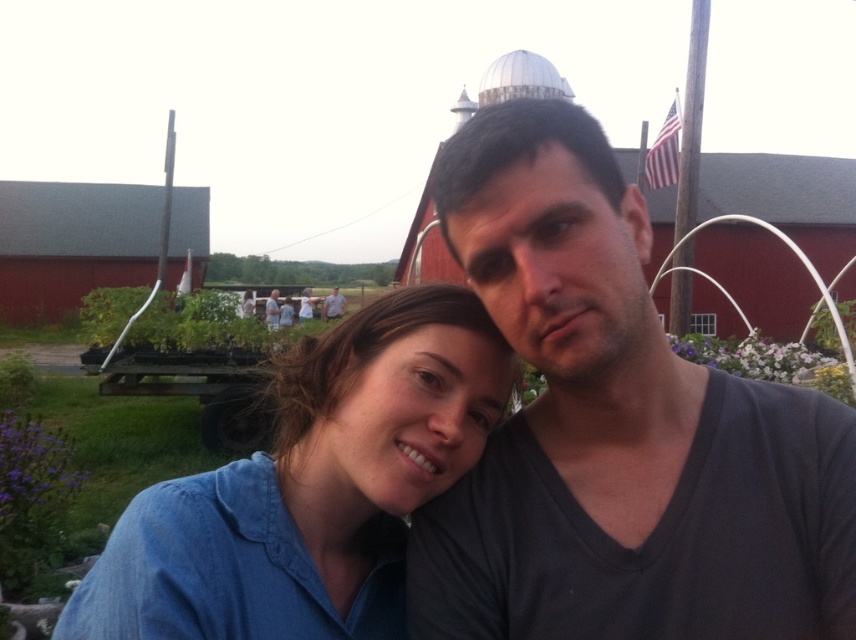
You are a photographer adjusting the camera settings to ensure both the blue denim shirt at center and the matte gray shirt at center are in focus. Which shirt should you focus on first to account for their sizes?

The blue denim shirt at center is taller than the matte gray shirt at center, so you should focus on the blue denim shirt at center first as it is larger and requires more precise focus.